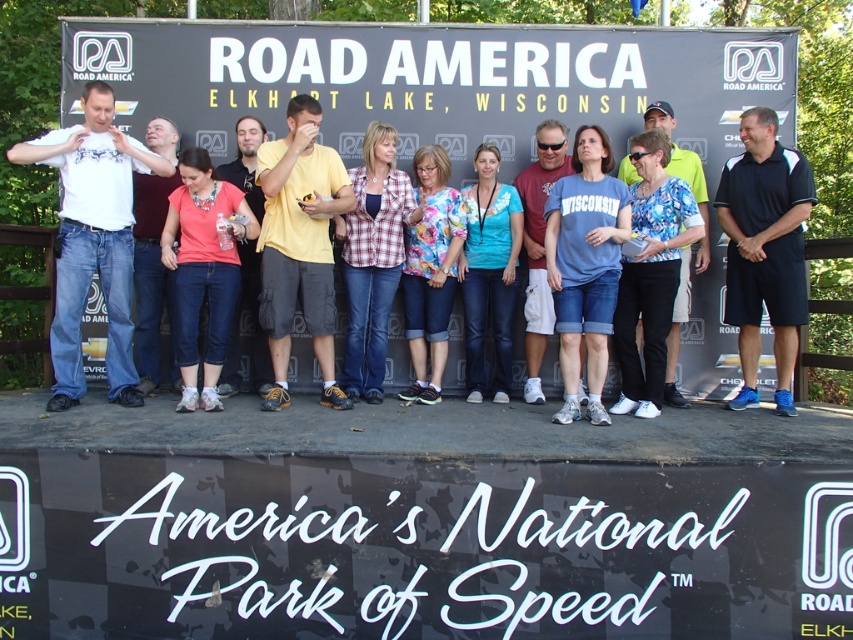
You are a photographer at the event and want to ensure both the yellow cotton shirt at center and the blue floral blouse at center are clearly visible in your photo. Based on their positions, which one is closer to the camera?

The yellow cotton shirt at center is in front of the blue floral blouse at center, so it is closer to the camera.

You are a photographer at the event and need to ensure all participants are visible in the photo. Considering the white cotton shirt at left and the blue floral blouse at center, which one might be partially hidden if the camera angle is too low?

The white cotton shirt at left is shorter than the blue floral blouse at center, so if the camera angle is too low, the white cotton shirt at left might be partially hidden because it is shorter and could be obscured by the stage or other elements.

Based on the photo, you are a photographer trying to capture a clear shot of the white cotton shirt at left and the yellow cotton shirt at center. Which shirt is closer to the camera?

The white cotton shirt at left is closer to the camera because it is positioned over the yellow cotton shirt at center.